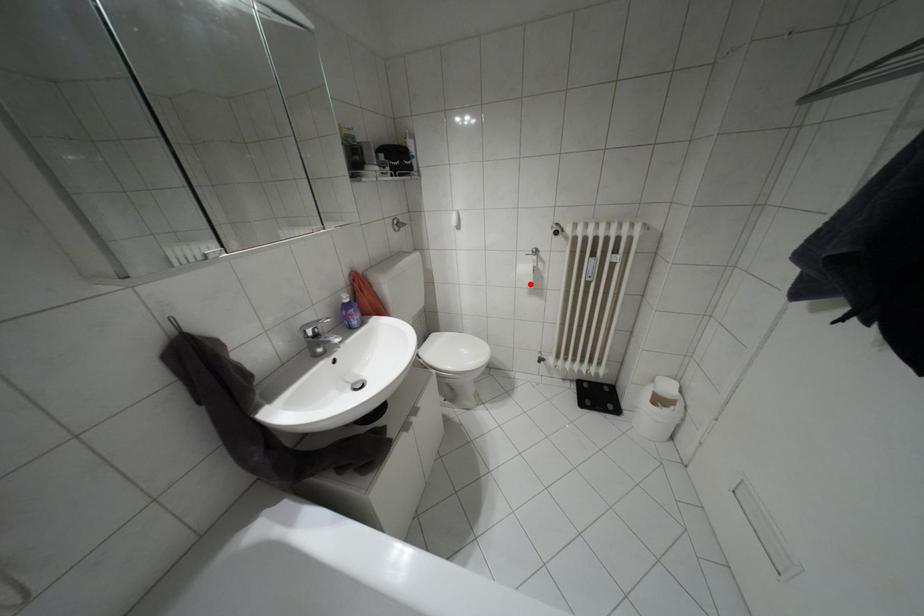
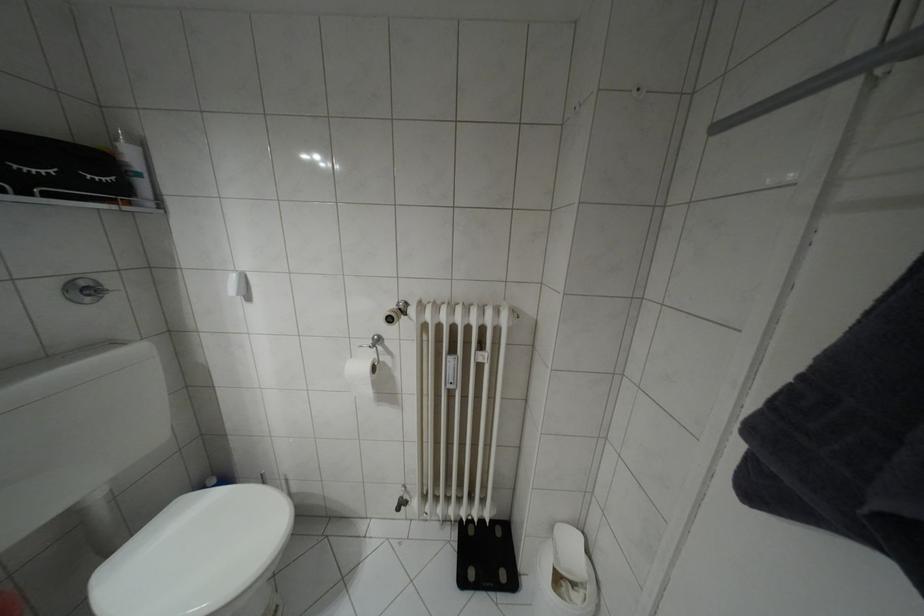
In the second image, find the point that corresponds to the highlighted location in the first image.

(369, 392)